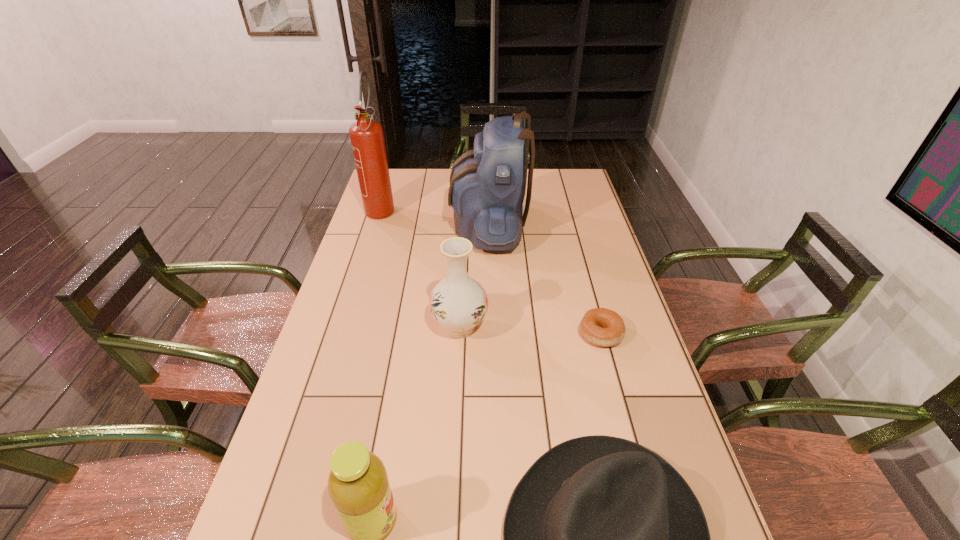
Locate an element on the screen. This screenshot has width=960, height=540. free space located 0.260m on the front of the bagel is located at coordinates (630, 443).

I want to click on fire extinguisher at the far edge, so click(367, 139).

Locate an element on the screen. This screenshot has width=960, height=540. backpack that is at the far edge is located at coordinates (487, 188).

Find the location of a particular element. This screenshot has width=960, height=540. object that is positioned at the left edge is located at coordinates (367, 139).

This screenshot has width=960, height=540. I want to click on object that is at the right edge, so click(602, 327).

Image resolution: width=960 pixels, height=540 pixels. What are the coordinates of `object present at the far left corner` in the screenshot? It's located at (367, 139).

Locate an element on the screen. The width and height of the screenshot is (960, 540). free spot at the left edge of the desktop is located at coordinates (326, 406).

I want to click on vacant region at the right edge of the desktop, so pos(585,282).

The width and height of the screenshot is (960, 540). In the image, there is a desktop. What are the coordinates of `vacant space at the far left corner` in the screenshot? It's located at (405, 197).

What are the coordinates of `vacant region at the far right corner of the desktop` in the screenshot? It's located at (546, 177).